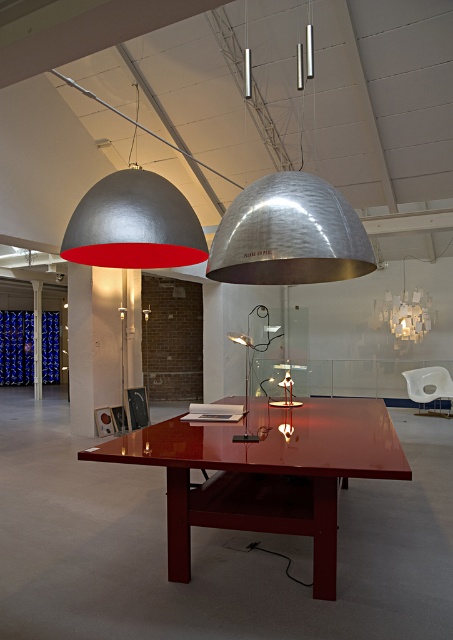
In the scene shown: Is metallic dome lamp at upper center to the left of white plastic chair at center from the viewer's perspective?

Indeed, metallic dome lamp at upper center is positioned on the left side of white plastic chair at center.

Is point (152, 205) in front of point (439, 394)?

That is True.

Where is `metallic dome lamp at upper center`? metallic dome lamp at upper center is located at coordinates (134, 225).

Can you confirm if metallic dome-shaped light fixture at upper center is shorter than white paper lampshade at upper center?

Yes, metallic dome-shaped light fixture at upper center is shorter than white paper lampshade at upper center.

Who is shorter, metallic dome-shaped light fixture at upper center or white paper lampshade at upper center?

With less height is metallic dome-shaped light fixture at upper center.

The image size is (453, 640). What do you see at coordinates (284, 216) in the screenshot? I see `metallic dome-shaped light fixture at upper center` at bounding box center [284, 216].

At what (x,y) coordinates should I click in order to perform the action: click on metallic dome-shaped light fixture at upper center. Please return your answer as a coordinate pair (x, y). Looking at the image, I should click on (284, 216).

Can you confirm if silver hammered metal dome at upper center is smaller than white paper lampshade at upper center?

Correct, silver hammered metal dome at upper center occupies less space than white paper lampshade at upper center.

Does silver hammered metal dome at upper center have a greater height compared to white paper lampshade at upper center?

No.

The width and height of the screenshot is (453, 640). I want to click on silver hammered metal dome at upper center, so click(x=289, y=234).